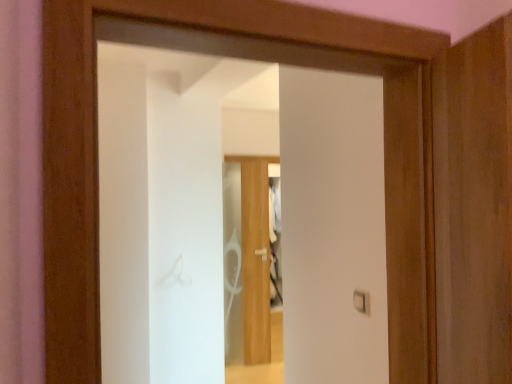
Question: Is white plastic light switch at center to the right of transparent glass door at center from the viewer's perspective?

Choices:
 (A) no
 (B) yes

Answer: (B)

Question: Is white plastic light switch at center smaller than transparent glass door at center?

Choices:
 (A) yes
 (B) no

Answer: (A)

Question: From the image's perspective, does white plastic light switch at center appear higher than transparent glass door at center?

Choices:
 (A) no
 (B) yes

Answer: (A)

Question: Does white plastic light switch at center lie behind transparent glass door at center?

Choices:
 (A) no
 (B) yes

Answer: (B)

Question: Can you confirm if white plastic light switch at center is wider than transparent glass door at center?

Choices:
 (A) no
 (B) yes

Answer: (A)

Question: Does white plastic light switch at center come in front of transparent glass door at center?

Choices:
 (A) no
 (B) yes

Answer: (A)

Question: From a real-world perspective, is transparent glass door at center located beneath white plastic light switch at center?

Choices:
 (A) no
 (B) yes

Answer: (A)

Question: Is transparent glass door at center in contact with white plastic light switch at center?

Choices:
 (A) yes
 (B) no

Answer: (B)

Question: Considering the relative sizes of transparent glass door at center and white plastic light switch at center in the image provided, is transparent glass door at center wider than white plastic light switch at center?

Choices:
 (A) yes
 (B) no

Answer: (A)

Question: Is the depth of transparent glass door at center greater than that of white plastic light switch at center?

Choices:
 (A) yes
 (B) no

Answer: (B)

Question: Does transparent glass door at center have a lesser width compared to white plastic light switch at center?

Choices:
 (A) yes
 (B) no

Answer: (B)

Question: Can you confirm if transparent glass door at center is bigger than white plastic light switch at center?

Choices:
 (A) no
 (B) yes

Answer: (B)

Question: In terms of width, does transparent glass door at center look wider or thinner when compared to white plastic light switch at center?

Choices:
 (A) thin
 (B) wide

Answer: (B)